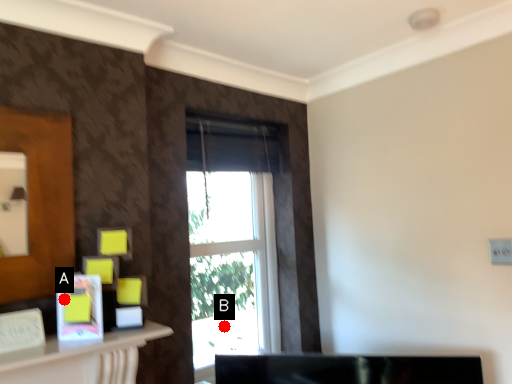
Question: Two points are circled on the image, labeled by A and B beside each circle. Which point is closer to the camera?

Choices:
 (A) A is closer
 (B) B is closer

Answer: (A)